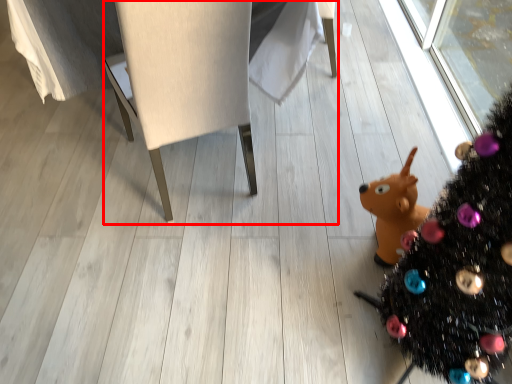
Question: From the image's perspective, what is the correct spatial relationship of furniture (annotated by the red box) in relation to christmas tree?

Choices:
 (A) above
 (B) below

Answer: (A)